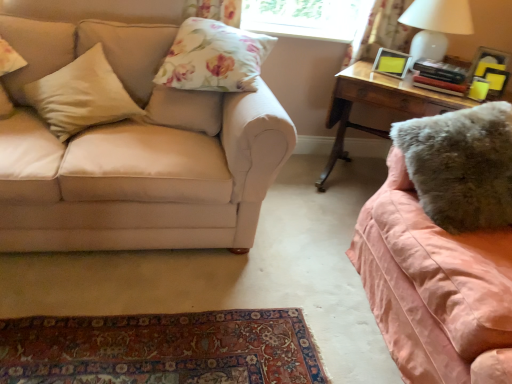
Question: Could you tell me if fuzzy gray pillow at right, marked as the fourth pillow in a left-to-right arrangement, is facing beige fabric pillow at left, marked as the fourth pillow in a right-to-left arrangement?

Choices:
 (A) no
 (B) yes

Answer: (B)

Question: Does fuzzy gray pillow at right, marked as the fourth pillow in a left-to-right arrangement, have a lesser height compared to beige fabric pillow at left, marked as the fourth pillow in a right-to-left arrangement?

Choices:
 (A) no
 (B) yes

Answer: (A)

Question: Is fuzzy gray pillow at right, the first pillow positioned from the right, positioned behind beige fabric pillow at left, marked as the fourth pillow in a right-to-left arrangement?

Choices:
 (A) yes
 (B) no

Answer: (B)

Question: Does fuzzy gray pillow at right, marked as the fourth pillow in a left-to-right arrangement, have a larger size compared to beige fabric pillow at left, marked as the fourth pillow in a right-to-left arrangement?

Choices:
 (A) yes
 (B) no

Answer: (A)

Question: From the image's perspective, would you say fuzzy gray pillow at right, marked as the fourth pillow in a left-to-right arrangement, is shown under beige fabric pillow at left, positioned as the first pillow in left-to-right order?

Choices:
 (A) no
 (B) yes

Answer: (B)

Question: From their relative heights in the image, would you say wooden desk at right is taller or shorter than beige fabric pillow at left, positioned as the first pillow in left-to-right order?

Choices:
 (A) short
 (B) tall

Answer: (B)

Question: From a real-world perspective, is wooden desk at right positioned above or below beige fabric pillow at left, marked as the fourth pillow in a right-to-left arrangement?

Choices:
 (A) below
 (B) above

Answer: (A)

Question: From the image's perspective, is wooden desk at right positioned above or below beige fabric pillow at left, marked as the fourth pillow in a right-to-left arrangement?

Choices:
 (A) below
 (B) above

Answer: (A)

Question: Is wooden desk at right inside the boundaries of beige fabric pillow at left, positioned as the first pillow in left-to-right order, or outside?

Choices:
 (A) inside
 (B) outside

Answer: (B)

Question: Do you think beige fabric pillow at left, marked as the fourth pillow in a right-to-left arrangement, is within floral fabric curtain at upper right, or outside of it?

Choices:
 (A) inside
 (B) outside

Answer: (B)

Question: From their relative heights in the image, would you say beige fabric pillow at left, marked as the fourth pillow in a right-to-left arrangement, is taller or shorter than floral fabric curtain at upper right?

Choices:
 (A) short
 (B) tall

Answer: (A)

Question: In terms of width, does beige fabric pillow at left, marked as the fourth pillow in a right-to-left arrangement, look wider or thinner when compared to floral fabric curtain at upper right?

Choices:
 (A) thin
 (B) wide

Answer: (A)

Question: Considering the relative positions of beige fabric pillow at left, positioned as the first pillow in left-to-right order, and floral fabric curtain at upper right in the image provided, is beige fabric pillow at left, positioned as the first pillow in left-to-right order, to the left or to the right of floral fabric curtain at upper right?

Choices:
 (A) right
 (B) left

Answer: (B)

Question: Do you think floral fabric pillow at upper center, the third pillow when ordered from left to right, is within wooden desk at right, or outside of it?

Choices:
 (A) outside
 (B) inside

Answer: (A)

Question: Is floral fabric pillow at upper center, which is counted as the second pillow, starting from the right, taller or shorter than wooden desk at right?

Choices:
 (A) tall
 (B) short

Answer: (B)